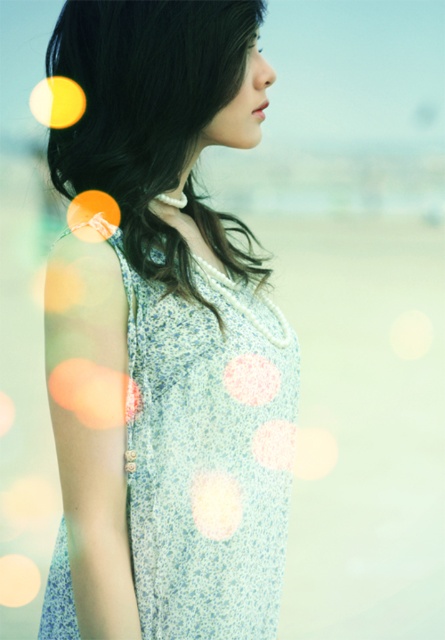
What do you see at coordinates (145, 109) in the screenshot? Image resolution: width=445 pixels, height=640 pixels. I see `dark brown silky hair at upper left` at bounding box center [145, 109].

Does dark brown silky hair at upper left lie behind pink fabric polka dot at center?

No.

Find the location of `dark brown silky hair at upper left`. dark brown silky hair at upper left is located at coordinates (145, 109).

Between white textured fabric at center and pink fabric polka dot at center, which one has less height?

pink fabric polka dot at center is shorter.

Can you confirm if white textured fabric at center is positioned to the left of pink fabric polka dot at center?

Correct, you'll find white textured fabric at center to the left of pink fabric polka dot at center.

Is point (210, 506) farther from viewer compared to point (270, 392)?

No, (210, 506) is in front of (270, 392).

Locate an element on the screen. The image size is (445, 640). white textured fabric at center is located at coordinates (215, 502).

Who is higher up, pink fabric polka dot at center or white dotted fabric at center?

pink fabric polka dot at center is above.

I want to click on pink fabric polka dot at center, so click(x=251, y=378).

I want to click on pink fabric polka dot at center, so click(x=251, y=378).